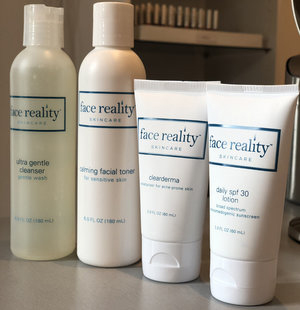
Find the location of `wall`. wall is located at coordinates [x=79, y=38], [x=286, y=48], [x=8, y=135].